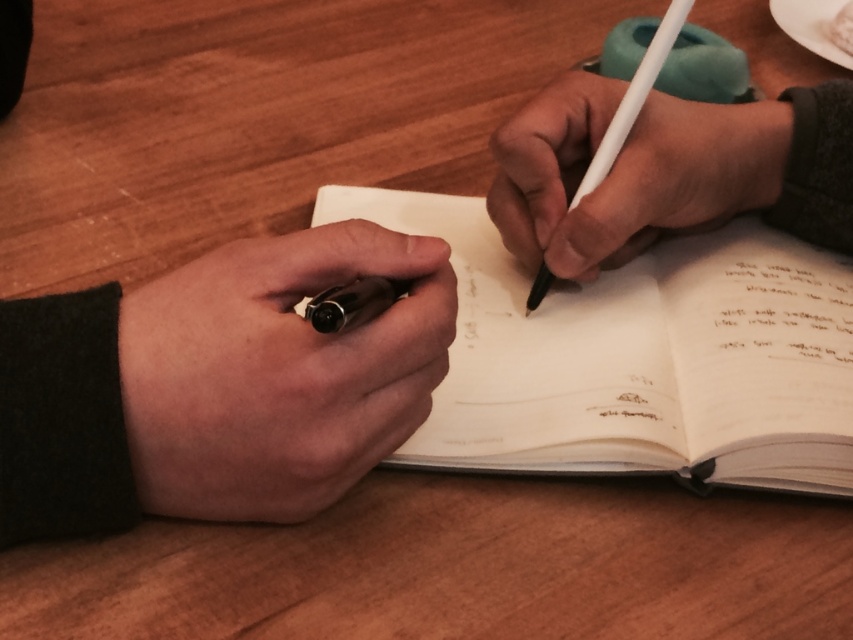
Question: Which is farther from the white matte pen at center?

Choices:
 (A) black ink handwriting at upper right
 (B) matte black pen at center
 (C) white paper notebook at center
 (D) white matte pencil at center

Answer: (B)

Question: Is white matte pen at center to the left of matte black pen at center from the viewer's perspective?

Choices:
 (A) yes
 (B) no

Answer: (B)

Question: Can you confirm if white matte pencil at center is positioned above matte black pen at center?

Choices:
 (A) no
 (B) yes

Answer: (B)

Question: Which point is closer to the camera taking this photo?

Choices:
 (A) (686, 8)
 (B) (223, 323)
 (C) (759, 113)
 (D) (824, 289)

Answer: (B)

Question: Which object is positioned farthest from the white matte pencil at center?

Choices:
 (A) black ink handwriting at upper right
 (B) white matte pen at center
 (C) matte black pen at center

Answer: (C)

Question: Where is matte black pen at left located in relation to white matte pencil at center in the image?

Choices:
 (A) right
 (B) left

Answer: (B)